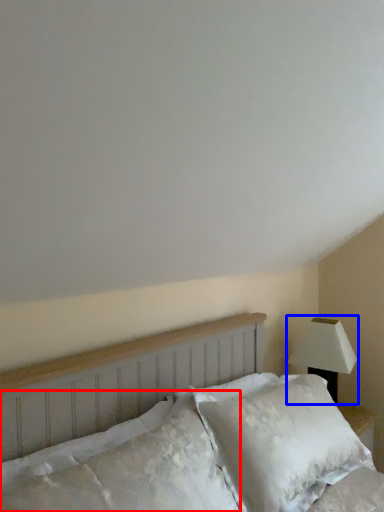
Question: Among these objects, which one is nearest to the camera, pillow (highlighted by a red box) or lamp (highlighted by a blue box)?

Choices:
 (A) pillow
 (B) lamp

Answer: (A)